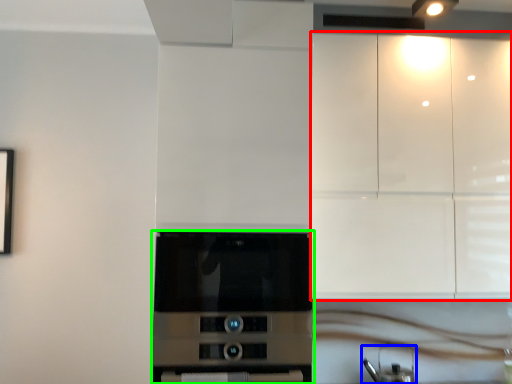
Question: Which is farther away from cabinetry (highlighted by a red box)? appliance (highlighted by a blue box) or home appliance (highlighted by a green box)?

Choices:
 (A) appliance
 (B) home appliance

Answer: (A)